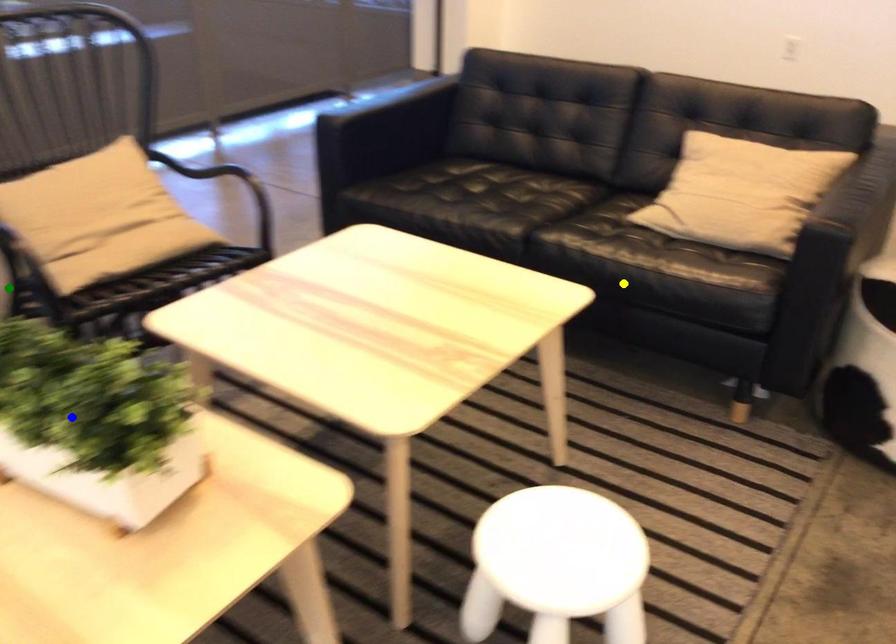
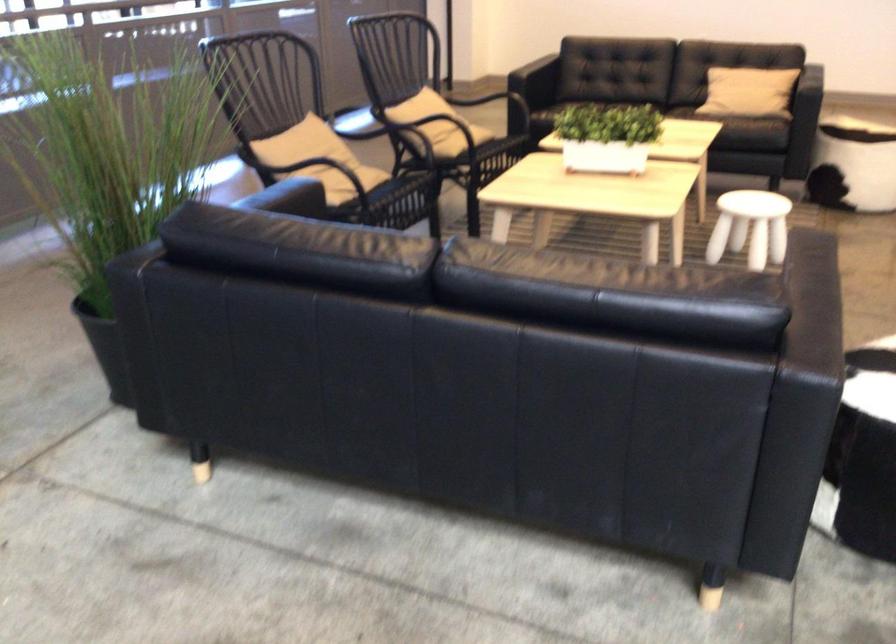
I am providing you with two images of the same scene from different viewpoints. Three points are marked in image1. Which point corresponds to a part or object that is occluded in image2?In image1, three points are marked. Which of them correspond to a part or object that is occluded in image2?Among the three points shown in image1, which one corresponds to a part or object that is no longer visible due to occlusion in image2?

green point